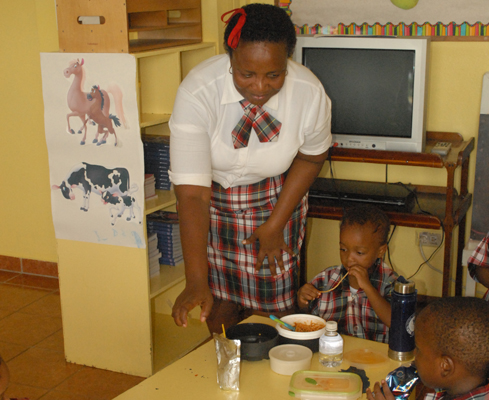
Where is `monitor`? monitor is located at coordinates (361, 107).